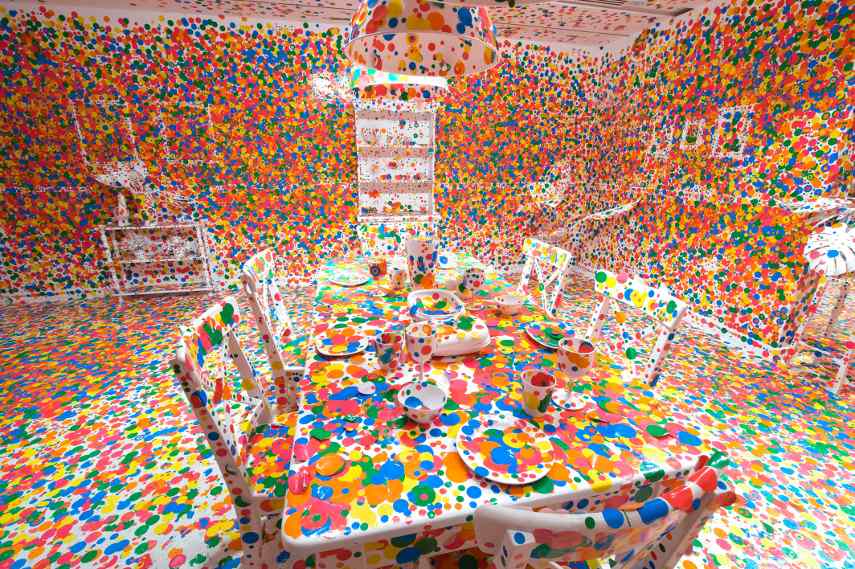
Locate an element on the screen. The height and width of the screenshot is (569, 855). plate is located at coordinates (534, 333).